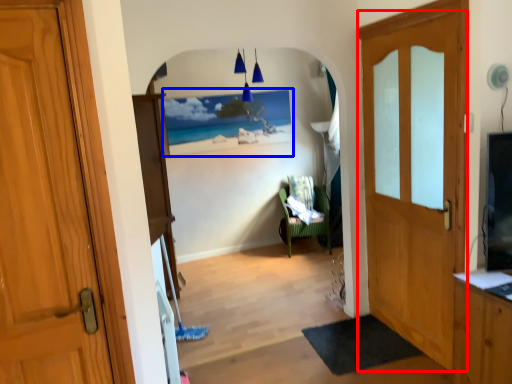
Question: Which of the following is the farthest to the observer, door (highlighted by a red box) or picture frame (highlighted by a blue box)?

Choices:
 (A) door
 (B) picture frame

Answer: (B)